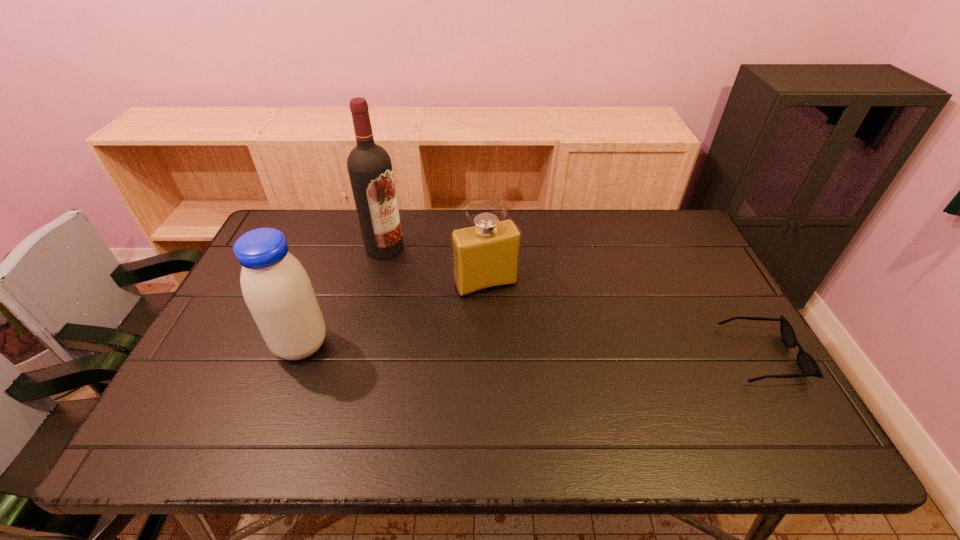
Find the location of `free spot on the desktop that is between the third shortest object and the rightmost object and is positioned on the front-facing side of the second object from right to left`. free spot on the desktop that is between the third shortest object and the rightmost object and is positioned on the front-facing side of the second object from right to left is located at coordinates (517, 350).

Locate an element on the screen. The width and height of the screenshot is (960, 540). vacant space on the desktop that is between the soya milk and the sunglasses and is positioned on the label of the farthest object is located at coordinates (478, 349).